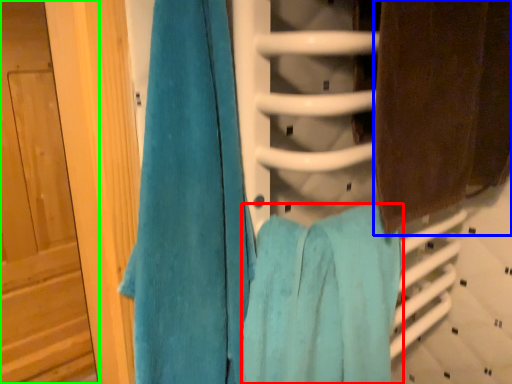
Question: Which object is positioned closest to towel (highlighted by a red box)? Select from towel (highlighted by a blue box) and door (highlighted by a green box).

Choices:
 (A) towel
 (B) door

Answer: (A)